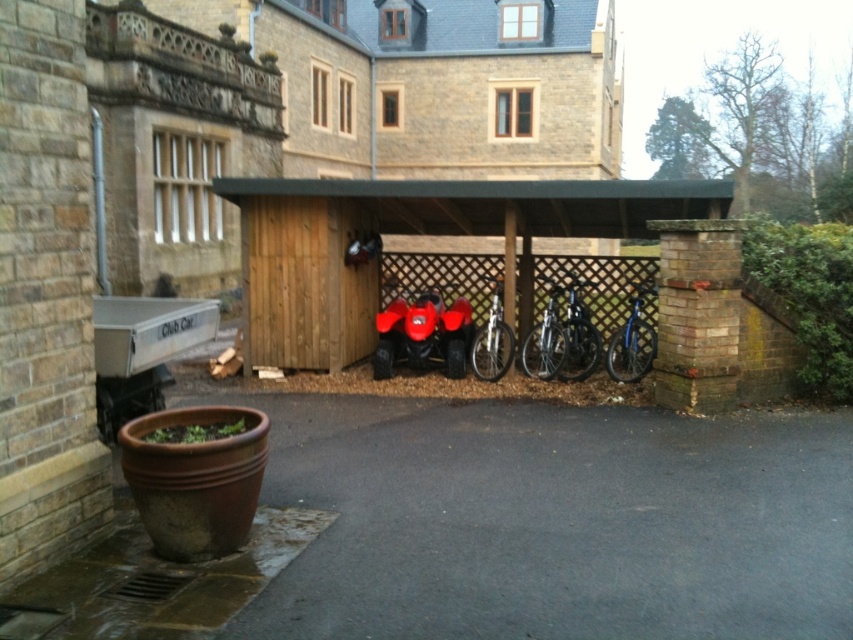
Question: Can you confirm if shiny red quad bike at center is wider than shiny black bicycle at center?

Choices:
 (A) yes
 (B) no

Answer: (A)

Question: Which is nearer to the shiny red quad bike at center?

Choices:
 (A) wooden bike rack at center
 (B) silver metallic bicycle at center

Answer: (B)

Question: Among these points, which one is nearest to the camera?

Choices:
 (A) (314, 225)
 (B) (463, 305)
 (C) (544, 342)
 (D) (624, 362)

Answer: (C)

Question: Which of the following is the farthest from the observer?

Choices:
 (A) shiny red quad bike at center
 (B) shiny metallic bicycle at center
 (C) blue metallic bicycle at center-right

Answer: (A)

Question: Is shiny red quad bike at center above blue metallic bicycle at center-right?

Choices:
 (A) yes
 (B) no

Answer: (B)

Question: Does blue metallic bicycle at center-right have a larger size compared to shiny metallic bicycle at center?

Choices:
 (A) yes
 (B) no

Answer: (A)